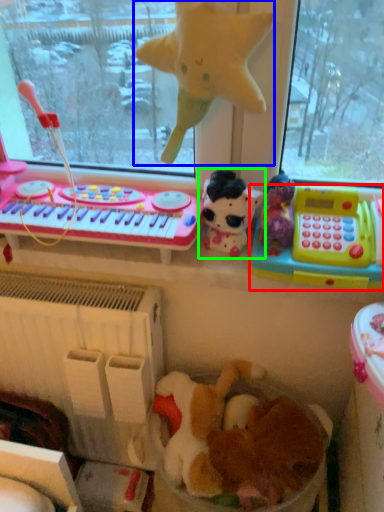
Question: Which is farther away from toy (highlighted by a red box)? toy (highlighted by a blue box) or toy (highlighted by a green box)?

Choices:
 (A) toy
 (B) toy

Answer: (A)